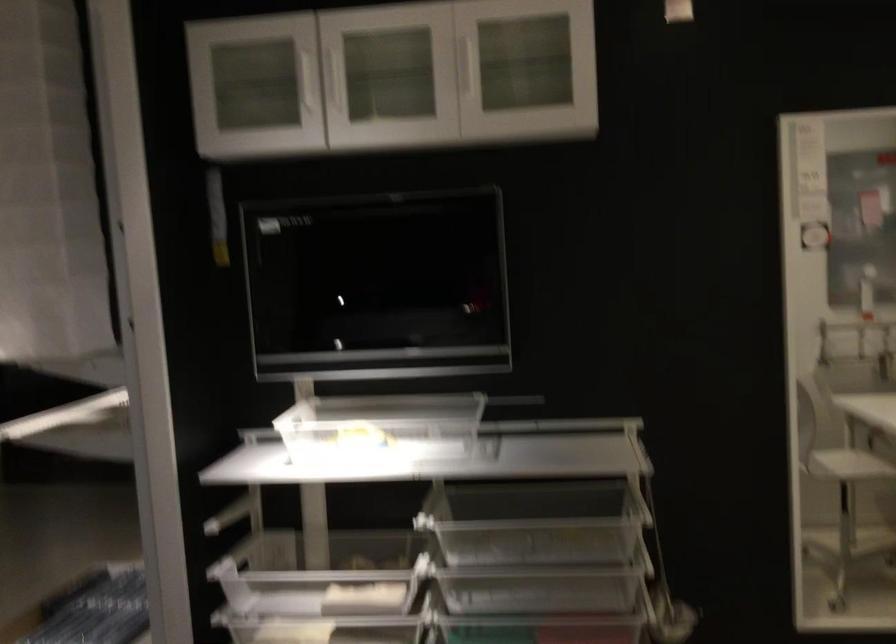
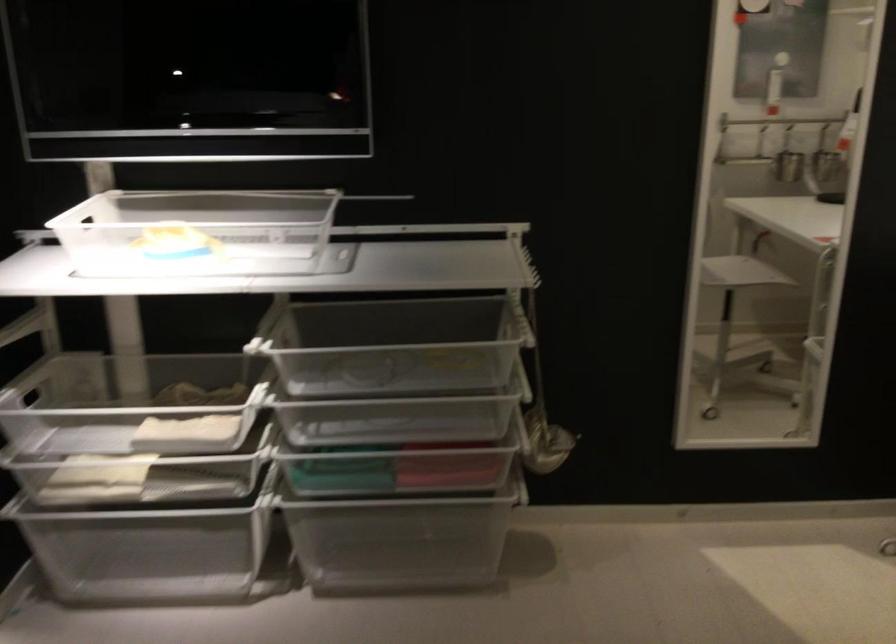
Question: How did the camera likely rotate?

Choices:
 (A) Left
 (B) Right
 (C) Up
 (D) Down

Answer: (D)